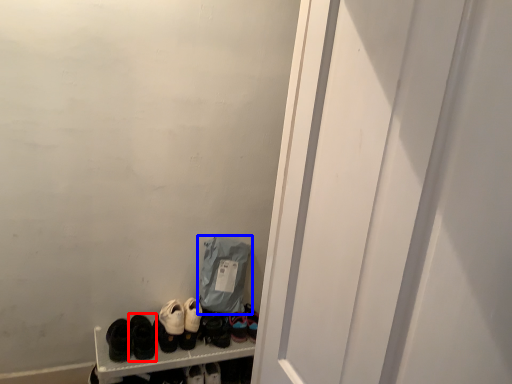
Question: Among these objects, which one is nearest to the camera, footwear (highlighted by a red box) or bag (highlighted by a blue box)?

Choices:
 (A) footwear
 (B) bag

Answer: (A)